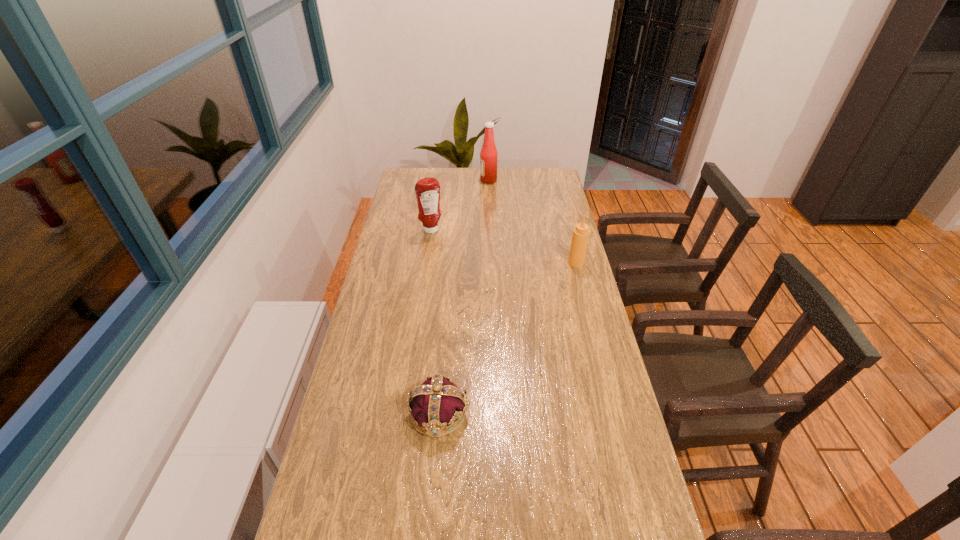
This screenshot has width=960, height=540. Identify the location of the tallest condiment. click(x=488, y=155).

The height and width of the screenshot is (540, 960). I want to click on the farthest object, so click(x=488, y=155).

Where is `the second farthest object`? the second farthest object is located at coordinates (427, 190).

Locate an element on the screen. the leftmost condiment is located at coordinates (427, 190).

You are a GUI agent. You are given a task and a screenshot of the screen. Output one action in this format:
    pyautogui.click(x=<x>, y=<y>)
    Task: Click on the rightmost object
    Image resolution: width=960 pixels, height=540 pixels.
    Given the screenshot: What is the action you would take?
    pyautogui.click(x=580, y=237)

Find the location of a particular element. This screenshot has height=540, width=960. the rightmost condiment is located at coordinates (580, 237).

What are the coordinates of `the nearest object` in the screenshot? It's located at (437, 402).

What are the coordinates of `the shortest object` in the screenshot? It's located at (437, 402).

This screenshot has width=960, height=540. In order to click on free location located on the front-facing side of the tallest object in this screenshot , I will do `click(414, 180)`.

You are a GUI agent. You are given a task and a screenshot of the screen. Output one action in this format:
    pyautogui.click(x=<x>, y=<y>)
    Task: Click on the vacant space located on the front-facing side of the tallest object
    This screenshot has width=960, height=540.
    Given the screenshot: What is the action you would take?
    pyautogui.click(x=420, y=180)